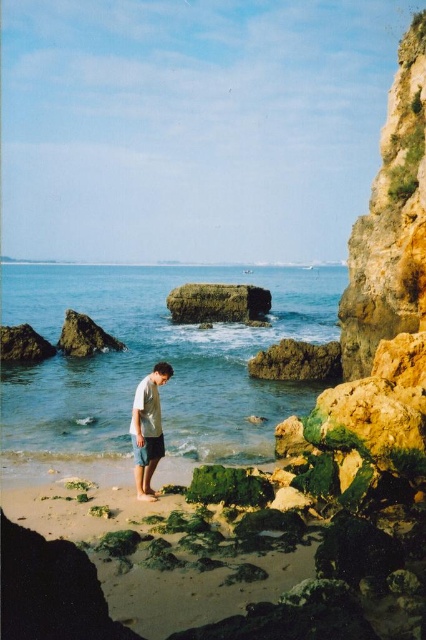
Can you confirm if clear blue water at center is shorter than sandy beach at lower center?

No, clear blue water at center is not shorter than sandy beach at lower center.

Between point (204, 394) and point (319, 625), which one is positioned in front?

Point (319, 625)

You are a GUI agent. You are given a task and a screenshot of the screen. Output one action in this format:
    pyautogui.click(x=<x>, y=<y>)
    Task: Click on the clear blue water at center
    The image size is (426, 640).
    Given the screenshot: What is the action you would take?
    pyautogui.click(x=157, y=358)

Does sandy beach at lower center appear over dark gray shorts at lower center?

No, sandy beach at lower center is not above dark gray shorts at lower center.

The height and width of the screenshot is (640, 426). What do you see at coordinates (147, 568) in the screenshot?
I see `sandy beach at lower center` at bounding box center [147, 568].

Locate an element on the screen. The width and height of the screenshot is (426, 640). sandy beach at lower center is located at coordinates (147, 568).

Which is more to the left, clear blue water at center or light gray cotton shorts at center?

clear blue water at center

Where is `clear blue water at center`? clear blue water at center is located at coordinates (157, 358).